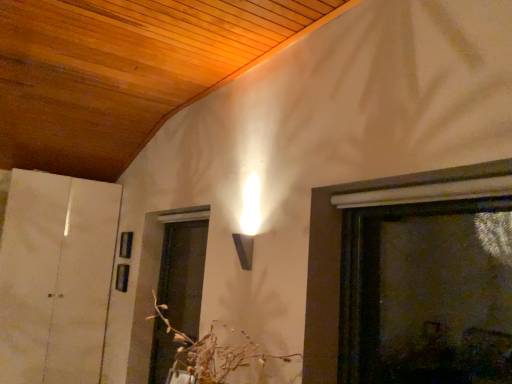
What do you see at coordinates (55, 277) in the screenshot?
I see `white paper at left` at bounding box center [55, 277].

Image resolution: width=512 pixels, height=384 pixels. Describe the element at coordinates (183, 274) in the screenshot. I see `translucent glass screen door at lower center` at that location.

What is the approximate height of brown textured floral arrangement at center?

brown textured floral arrangement at center is 20.36 inches tall.

Image resolution: width=512 pixels, height=384 pixels. In order to click on white paper at left in this screenshot , I will do `click(55, 277)`.

Can you tell me how much white paper at left and translucent glass screen door at lower center differ in facing direction?

There is a 90-degree angle between the facing directions of white paper at left and translucent glass screen door at lower center.

At what (x,y) coordinates should I click in order to perform the action: click on screen door on the right of the white paper at left. Please return your answer as a coordinate pair (x, y). Looking at the image, I should click on (183, 274).

Between white paper at left and translucent glass screen door at lower center, which one is positioned in front?

Positioned in front is translucent glass screen door at lower center.

Is white paper at left surrounding translucent glass screen door at lower center?

Definitely not — translucent glass screen door at lower center is not inside white paper at left.

Is brown textured floral arrangement at center in front of translucent glass screen door at lower center?

Yes, it is.

Would you say brown textured floral arrangement at center is inside or outside translucent glass screen door at lower center?

brown textured floral arrangement at center is not enclosed by translucent glass screen door at lower center.

From a real-world perspective, relative to translucent glass screen door at lower center, is brown textured floral arrangement at center vertically above or below?

brown textured floral arrangement at center is below translucent glass screen door at lower center.

Between translucent glass screen door at lower center and white paper at left, which one has larger width?

With larger width is white paper at left.

Can you confirm if translucent glass screen door at lower center is smaller than white paper at left?

Indeed, translucent glass screen door at lower center has a smaller size compared to white paper at left.

Where is `screen door on the right of white paper at left`? screen door on the right of white paper at left is located at coordinates (183, 274).

Is translucent glass screen door at lower center positioned with its back to white paper at left?

No, translucent glass screen door at lower center's orientation is not away from white paper at left.

Is white paper at left at the back of brown textured floral arrangement at center?

No, brown textured floral arrangement at center is not facing the opposite direction of white paper at left.

Is point (173, 330) positioned behind point (67, 283)?

No, (173, 330) is in front of (67, 283).

Is brown textured floral arrangement at center touching white paper at left?

No, brown textured floral arrangement at center is not beside white paper at left.

From the image's perspective, is brown textured floral arrangement at center above white paper at left?

Indeed, from the image's perspective, brown textured floral arrangement at center is shown above white paper at left.

Does white paper at left turn towards brown textured floral arrangement at center?

Yes, white paper at left is oriented towards brown textured floral arrangement at center.

From a real-world perspective, is white paper at left below brown textured floral arrangement at center?

No.

Considering the sizes of white paper at left and brown textured floral arrangement at center in the image, is white paper at left taller or shorter than brown textured floral arrangement at center?

In the image, white paper at left appears to be taller than brown textured floral arrangement at center.

How different are the orientations of white paper at left and brown textured floral arrangement at center in degrees?

They differ by 91 degrees in their facing directions.

Is brown textured floral arrangement at center at the back of translucent glass screen door at lower center?

That's not correct — translucent glass screen door at lower center is not looking away from brown textured floral arrangement at center.

Consider the image. Which of these two, translucent glass screen door at lower center or brown textured floral arrangement at center, is wider?

Wider between the two is brown textured floral arrangement at center.

Is point (160, 335) behind point (225, 363)?

Yes, point (160, 335) is farther from viewer.

Which of these two, translucent glass screen door at lower center or brown textured floral arrangement at center, is bigger?

brown textured floral arrangement at center.

Where is `door above the translucent glass screen door at lower center (from the image's perspective)`? door above the translucent glass screen door at lower center (from the image's perspective) is located at coordinates (55, 277).

Where is `flower in front of the translucent glass screen door at lower center`? flower in front of the translucent glass screen door at lower center is located at coordinates (208, 354).

From the image, which object appears to be nearer to brown textured floral arrangement at center, white paper at left or translucent glass screen door at lower center?

translucent glass screen door at lower center lies closer to brown textured floral arrangement at center than the other object.

Based on their spatial positions, is brown textured floral arrangement at center or white paper at left closer to translucent glass screen door at lower center?

white paper at left.

When comparing their distances from translucent glass screen door at lower center, does white paper at left or brown textured floral arrangement at center seem further?

Based on the image, brown textured floral arrangement at center appears to be further to translucent glass screen door at lower center.

Estimate the real-world distances between objects in this image. Which object is further from white paper at left, brown textured floral arrangement at center or translucent glass screen door at lower center?

brown textured floral arrangement at center.

From the image, which object appears to be farther from brown textured floral arrangement at center, translucent glass screen door at lower center or white paper at left?

white paper at left is further to brown textured floral arrangement at center.

Based on the photo, considering their positions, is translucent glass screen door at lower center positioned closer to white paper at left than brown textured floral arrangement at center?

translucent glass screen door at lower center.

I want to click on screen door between brown textured floral arrangement at center and white paper at left from front to back, so point(183,274).